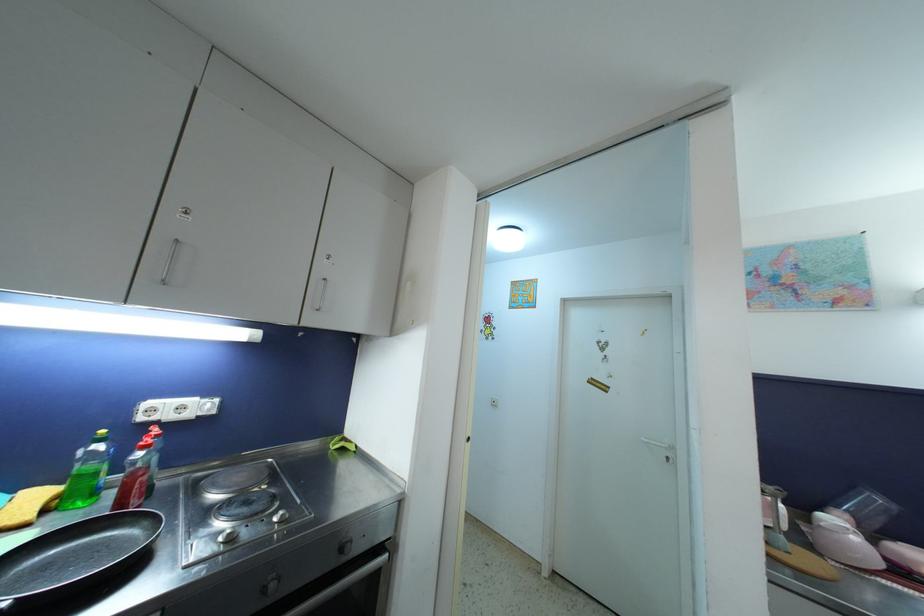
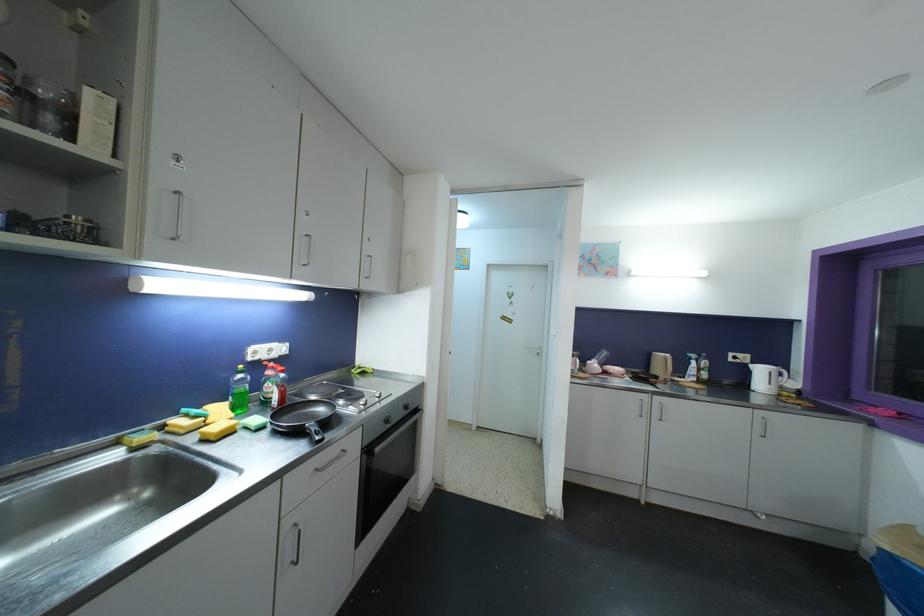
The point at [148,450] is marked in the first image. Where is the corresponding point in the second image?

(286, 374)